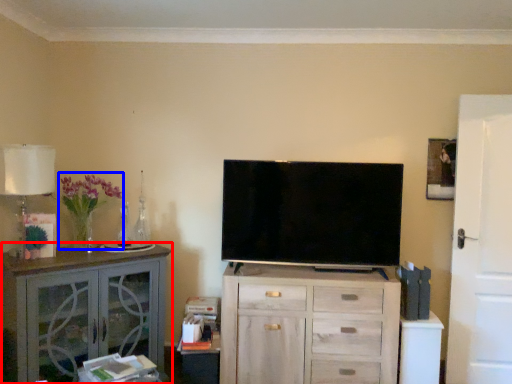
Question: Which object appears farthest to the camera in this image, cabinetry (highlighted by a red box) or flower (highlighted by a blue box)?

Choices:
 (A) cabinetry
 (B) flower

Answer: (B)